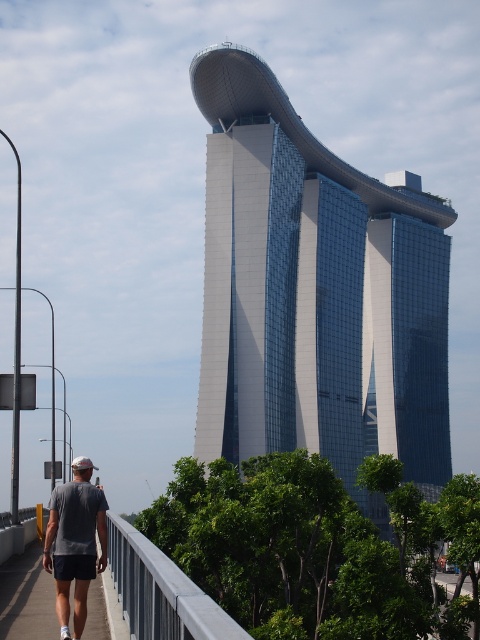
Question: Is gray concrete sidewalk at lower left thinner than white fabric baseball cap at lower left?

Choices:
 (A) yes
 (B) no

Answer: (A)

Question: Is glassy steel tower at center wider than gray concrete sidewalk at lower left?

Choices:
 (A) yes
 (B) no

Answer: (A)

Question: Which object is positioned farthest from the gray concrete sidewalk at lower left?

Choices:
 (A) gray metallic rail at lower center
 (B) glassy steel tower at center

Answer: (B)

Question: Can you confirm if gray metallic rail at lower center is bigger than gray fabric shirt at lower left?

Choices:
 (A) yes
 (B) no

Answer: (B)

Question: Estimate the real-world distances between objects in this image. Which object is farther from the gray concrete sidewalk at lower left?

Choices:
 (A) gray metallic rail at lower center
 (B) white fabric baseball cap at lower left

Answer: (B)

Question: Estimate the real-world distances between objects in this image. Which object is closer to the gray fabric shirt at lower left?

Choices:
 (A) white fabric baseball cap at lower left
 (B) glassy steel tower at center
 (C) gray metallic rail at lower center
 (D) gray concrete sidewalk at lower left

Answer: (D)